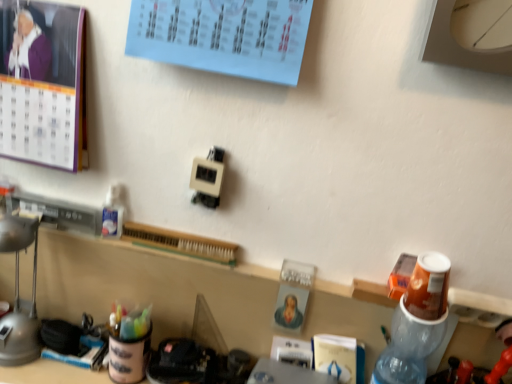
Question: Is matte gray lamp at left bigger or smaller than purple paper calendar at upper left?

Choices:
 (A) big
 (B) small

Answer: (B)

Question: Looking at their shapes, would you say matte gray lamp at left is wider or thinner than purple paper calendar at upper left?

Choices:
 (A) wide
 (B) thin

Answer: (A)

Question: Which of these objects is positioned farthest from the purple paper calendar at upper left?

Choices:
 (A) matte gray lamp at left
 (B) translucent plastic bottle at right

Answer: (B)

Question: Which object is positioned closest to the purple paper calendar at upper left?

Choices:
 (A) matte gray lamp at left
 (B) translucent plastic bottle at right

Answer: (A)